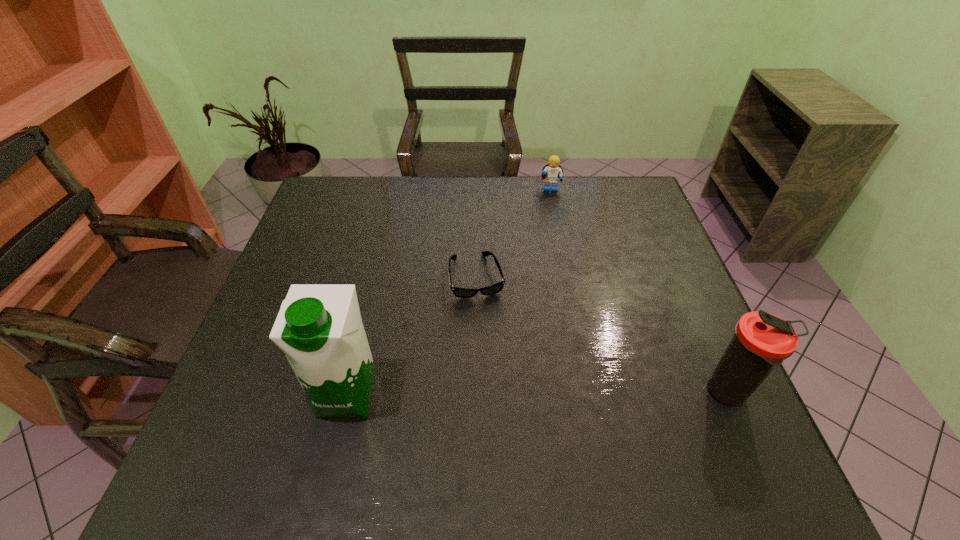
Locate an element on the screen. Image resolution: width=960 pixels, height=540 pixels. vacant space located 0.070m on the front-facing side of the shortest object is located at coordinates (487, 322).

Find the location of a particular element. vacant area situated on the front-facing side of the shortest object is located at coordinates (486, 319).

At what (x,y) coordinates should I click in order to perform the action: click on vacant area situated on the front-facing side of the Lego. Please return your answer as a coordinate pair (x, y). Looking at the image, I should click on (549, 207).

Locate an element on the screen. The image size is (960, 540). vacant space located 0.210m on the front-facing side of the Lego is located at coordinates (548, 236).

The width and height of the screenshot is (960, 540). In order to click on vacant point located on the front-facing side of the Lego in this screenshot , I will do `click(549, 207)`.

Where is `object located at the far edge`? object located at the far edge is located at coordinates (552, 172).

Locate an element on the screen. Image resolution: width=960 pixels, height=540 pixels. soya milk present at the near edge is located at coordinates (319, 328).

At what (x,y) coordinates should I click in order to perform the action: click on thermos bottle located in the near edge section of the desktop. Please return your answer as a coordinate pair (x, y). This screenshot has height=540, width=960. Looking at the image, I should click on (762, 341).

Image resolution: width=960 pixels, height=540 pixels. Find the location of `object that is positioned at the right edge`. object that is positioned at the right edge is located at coordinates (762, 341).

This screenshot has height=540, width=960. Identify the location of object that is at the near right corner. (762, 341).